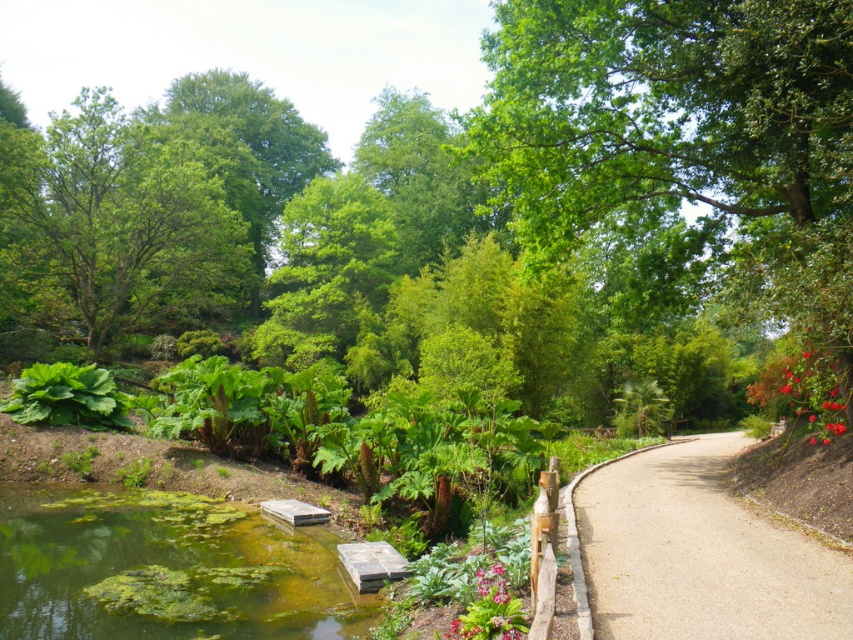
Question: Which point is farther to the camera?

Choices:
 (A) (733, 160)
 (B) (498, 600)
 (C) (613, 628)

Answer: (A)

Question: Is green leafy tree at upper left bigger than smooth gravel path at center?

Choices:
 (A) yes
 (B) no

Answer: (A)

Question: Which of these objects is positioned farthest from the green leafy tree at upper left?

Choices:
 (A) green algae-covered water at lower left
 (B) pink glossy flower at lower center
 (C) green leafy plant at lower center

Answer: (A)

Question: Which is farther from the smooth gravel path at center?

Choices:
 (A) green leafy tree at upper center
 (B) green algae-covered water at lower left

Answer: (B)

Question: Where is green algae-covered water at lower left located in relation to green leafy tree at upper left in the image?

Choices:
 (A) right
 (B) left

Answer: (A)

Question: Considering the relative positions of green leafy plant at lower center and pink glossy flower at lower center in the image provided, where is green leafy plant at lower center located with respect to pink glossy flower at lower center?

Choices:
 (A) below
 (B) above

Answer: (A)